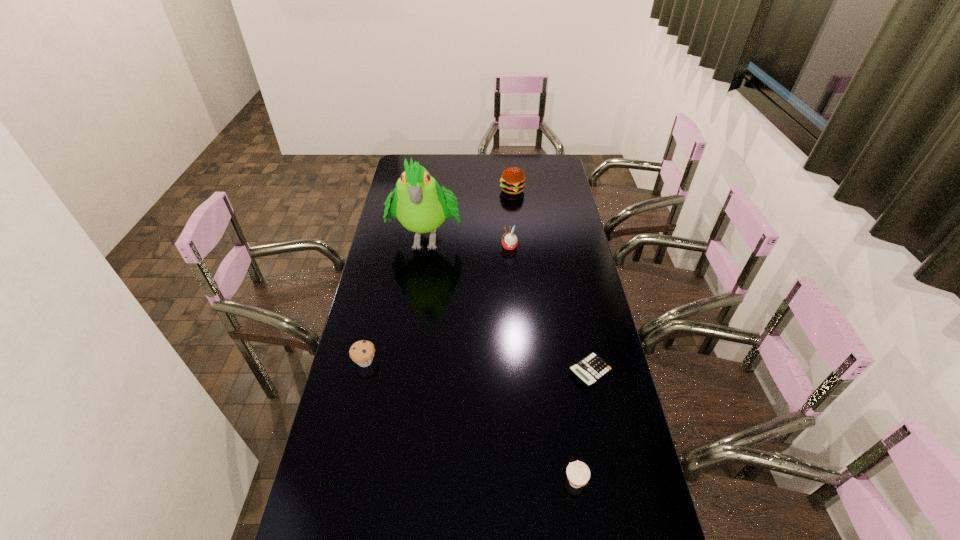
The width and height of the screenshot is (960, 540). Find the location of `vacant space situated on the front-facing side of the farthest muffin`. vacant space situated on the front-facing side of the farthest muffin is located at coordinates (454, 247).

Locate an element on the screen. vacant region located on the front-facing side of the farthest muffin is located at coordinates (428, 247).

Locate an element on the screen. This screenshot has height=540, width=960. free region located 0.120m on the front-facing side of the farthest muffin is located at coordinates (473, 247).

Locate an element on the screen. free location located on the back of the nearest muffin is located at coordinates (566, 422).

Locate an element on the screen. This screenshot has height=540, width=960. free spot located 0.300m on the back of the second farthest muffin is located at coordinates (382, 288).

You are a GUI agent. You are given a task and a screenshot of the screen. Output one action in this format:
    pyautogui.click(x=<x>, y=<y>)
    Task: Click on the vacant region located 0.330m on the back of the calculator
    
    Given the screenshot: What is the action you would take?
    pyautogui.click(x=571, y=285)

What are the coordinates of `parakeet present at the left edge` in the screenshot? It's located at (419, 204).

The image size is (960, 540). Find the location of `muffin that is at the left edge`. muffin that is at the left edge is located at coordinates (362, 352).

Locate an element on the screen. muffin located at the right edge is located at coordinates (578, 473).

This screenshot has height=540, width=960. I want to click on calculator present at the right edge, so click(591, 369).